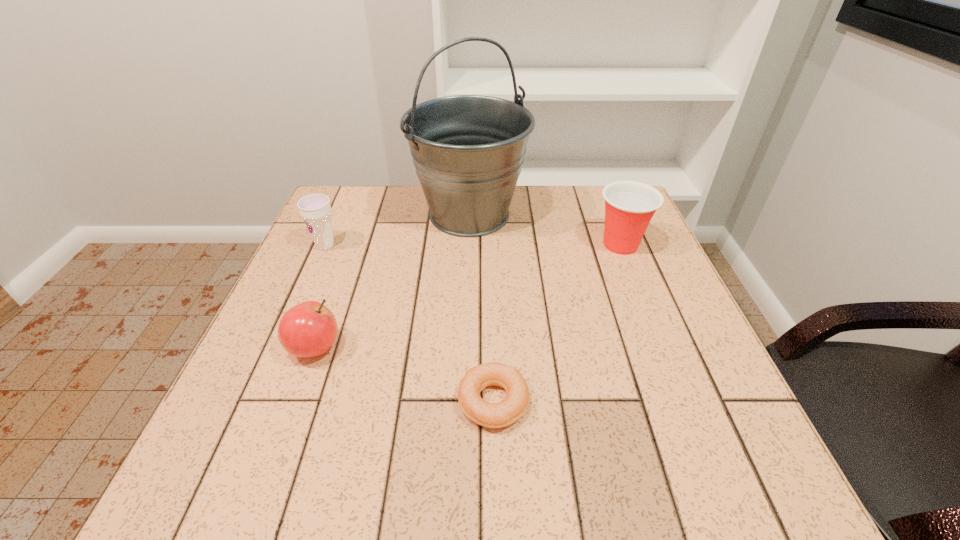
Locate an element on the screen. Image resolution: width=960 pixels, height=540 pixels. the tallest object is located at coordinates (468, 150).

Where is `the right cup`? Image resolution: width=960 pixels, height=540 pixels. the right cup is located at coordinates (629, 206).

Find the location of a particular element. the left cup is located at coordinates (315, 209).

Identify the location of the second nearest object. (309, 329).

Identify the location of apple. This screenshot has width=960, height=540. (309, 329).

This screenshot has width=960, height=540. What are the coordinates of `the shortest object` in the screenshot? It's located at (x=491, y=415).

The image size is (960, 540). In order to click on the nearest object in this screenshot , I will do `click(491, 415)`.

You are a GUI agent. You are given a task and a screenshot of the screen. Output one action in this format:
    pyautogui.click(x=<x>, y=<y>)
    Task: Click on the vacant area situated 0.090m on the left of the bucket
    Image resolution: width=960 pixels, height=540 pixels.
    Given the screenshot: What is the action you would take?
    pyautogui.click(x=378, y=214)

Where is `vacant point located on the back of the rightmost object`? The image size is (960, 540). vacant point located on the back of the rightmost object is located at coordinates (609, 217).

The width and height of the screenshot is (960, 540). I want to click on vacant space positioned on the right of the left cup, so click(384, 246).